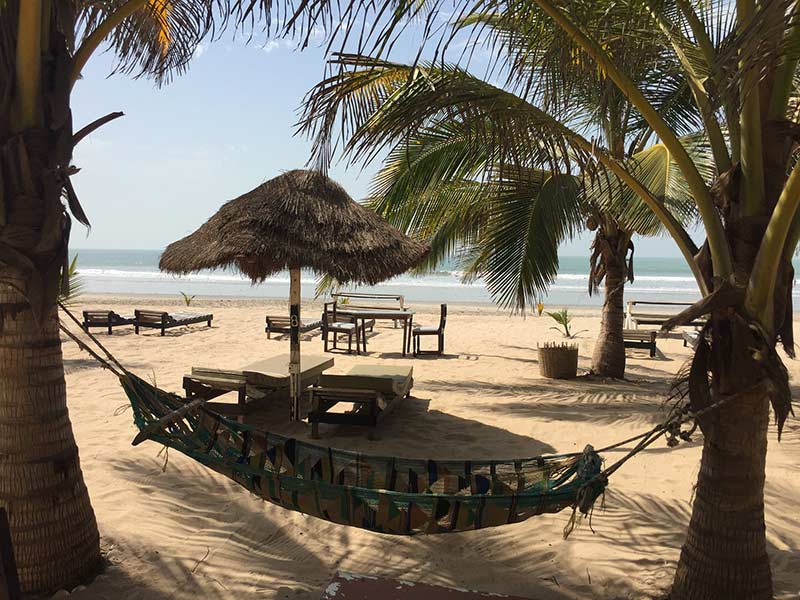
Where is `brown basket`? The width and height of the screenshot is (800, 600). brown basket is located at coordinates (556, 358).